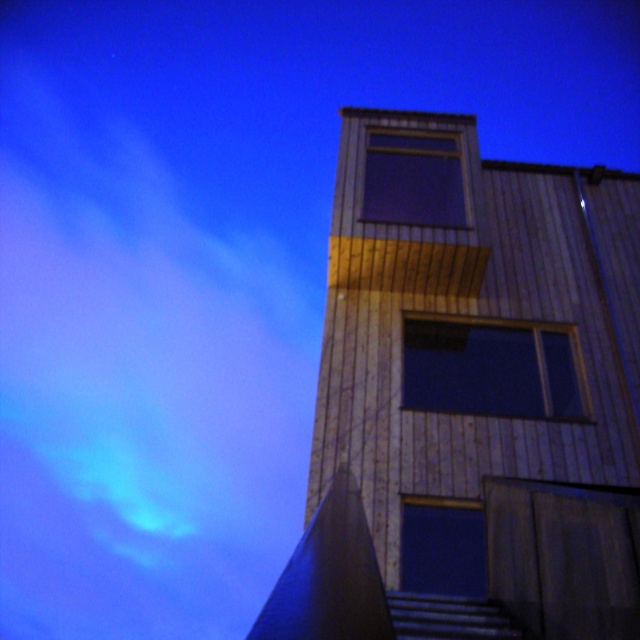
You are an architect analyzing the building facade. You observe the dark wood window at center and the dark glass window at center. Which window has a greater width according to the architectural plans?

The dark wood window at center has a greater width than the dark glass window at center as stated in the architectural plans.

You are standing in front of the building and want to know which of the two points, point (545, 381) or point (468, 570), is closer to you. Can you determine this based on their positions?

Point (468, 570) is closer to you because it is less further to the camera than point (545, 381).